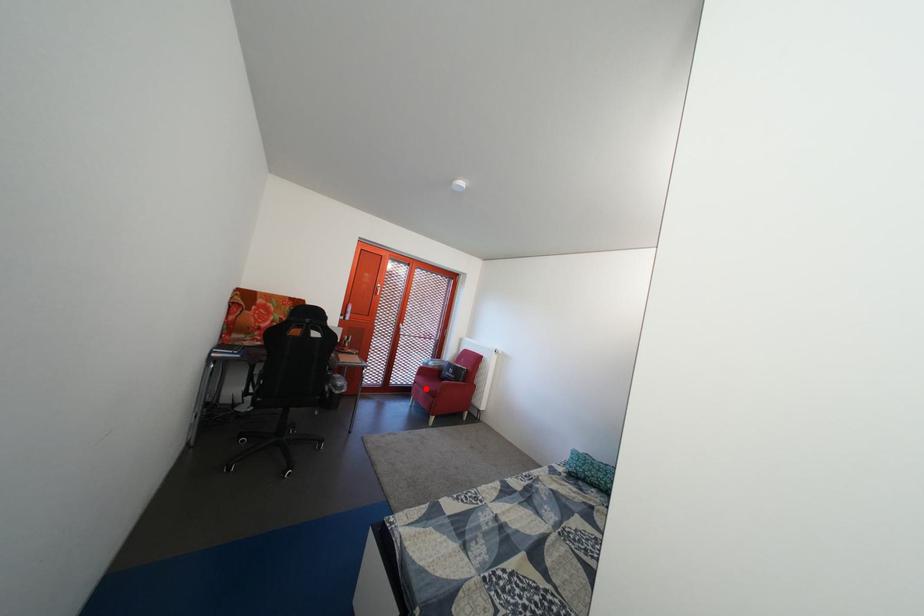
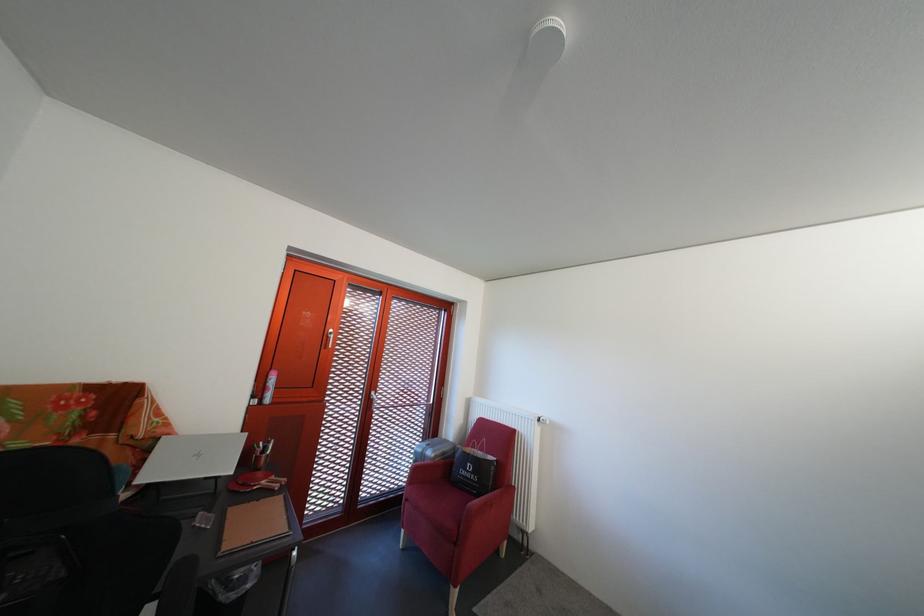
Question: I am providing you with two images of the same scene from different viewpoints. In image1, a red point is highlighted. Considering the same 3D point in image2, which of the following is correct?

Choices:
 (A) It is closer
 (B) It is farther

Answer: (A)